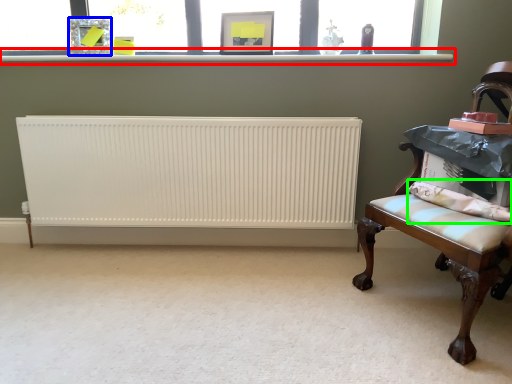
Question: Based on their relative distances, which object is farther from window sill (highlighted by a red box)? Choose from picture frame (highlighted by a blue box) and pillow (highlighted by a green box).

Choices:
 (A) picture frame
 (B) pillow

Answer: (B)